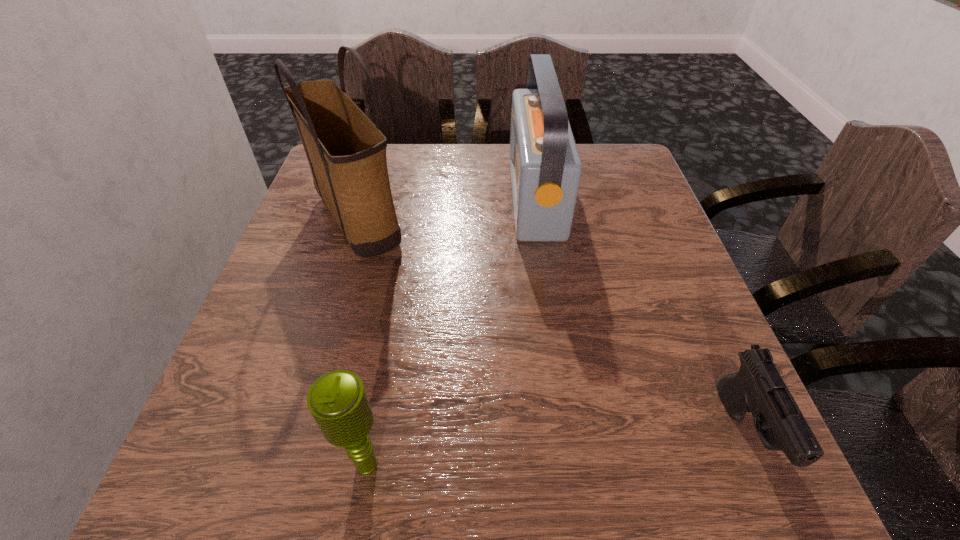
You are a GUI agent. You are given a task and a screenshot of the screen. Output one action in this format:
    pyautogui.click(x=<x>, y=<y>)
    Task: Click on the free spot between the microphone and the tallest object
    The width and height of the screenshot is (960, 540).
    Given the screenshot: What is the action you would take?
    click(362, 341)

Locate an element on the screen. Image resolution: width=960 pixels, height=540 pixels. free spot between the pistol and the tallest object is located at coordinates (551, 325).

This screenshot has width=960, height=540. What are the coordinates of `vacant area between the microphone and the tallest object` in the screenshot? It's located at (362, 341).

At what (x,y) coordinates should I click in order to perform the action: click on free point between the pistol and the radio receiver. Please return your answer as a coordinate pair (x, y). Looking at the image, I should click on (640, 314).

Locate an element on the screen. free space between the second tallest object and the rightmost object is located at coordinates (640, 314).

You are a GUI agent. You are given a task and a screenshot of the screen. Output one action in this format:
    pyautogui.click(x=<x>, y=<y>)
    Task: Click on the object that stands as the third closest to the pistol
    
    Given the screenshot: What is the action you would take?
    pyautogui.click(x=346, y=152)

Identify which object is the second nearest to the third object from left to right. Please provide its 2D coordinates. Your answer should be formatted as a tuple, i.e. [(x, y)], where the tuple contains the x and y coordinates of a point satisfying the conditions above.

[(758, 387)]